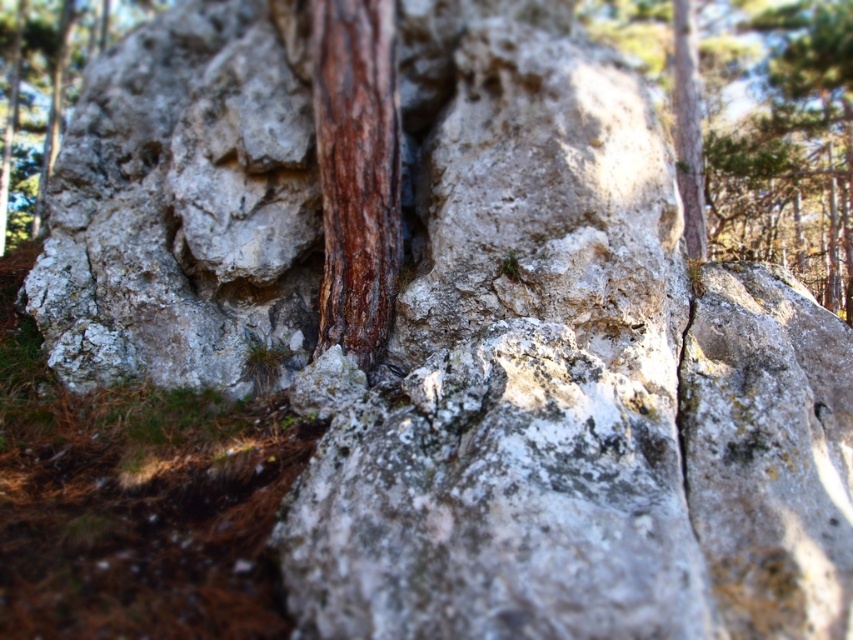
Question: Can you confirm if brown rough tree trunk at center is positioned below smooth brown tree trunk at left?

Choices:
 (A) no
 (B) yes

Answer: (B)

Question: Estimate the real-world distances between objects in this image. Which object is closer to the smooth brown tree trunk at left?

Choices:
 (A) brown rough tree trunk at center
 (B) brown rough bark at upper right

Answer: (A)

Question: Is brown rough tree trunk at center positioned in front of smooth brown tree trunk at left?

Choices:
 (A) yes
 (B) no

Answer: (A)

Question: Which point appears closest to the camera in this image?

Choices:
 (A) (80, 67)
 (B) (653, 48)
 (C) (363, 154)

Answer: (C)

Question: Which point is closer to the camera taking this photo?

Choices:
 (A) (38, 164)
 (B) (329, 328)
 (C) (769, 140)

Answer: (B)

Question: In this image, where is brown rough bark at upper right located relative to brown rough tree trunk at center?

Choices:
 (A) right
 (B) left

Answer: (A)